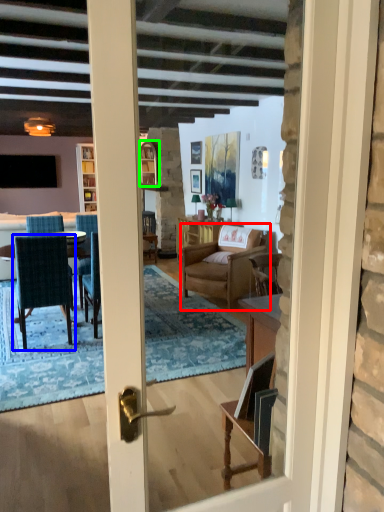
Question: Estimate the real-world distances between objects in this image. Which object is farther from chair (highlighted by a red box), chair (highlighted by a blue box) or window (highlighted by a green box)?

Choices:
 (A) chair
 (B) window

Answer: (A)